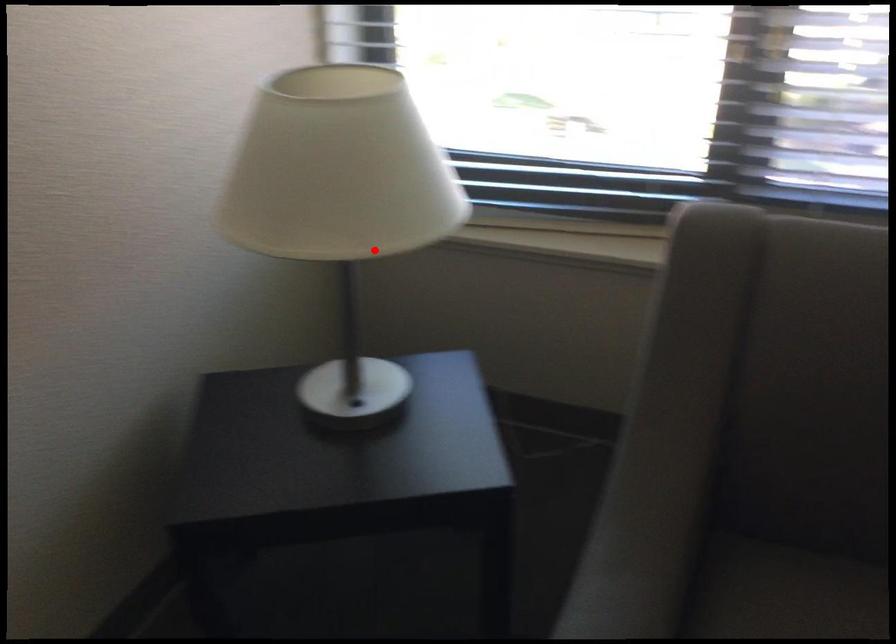
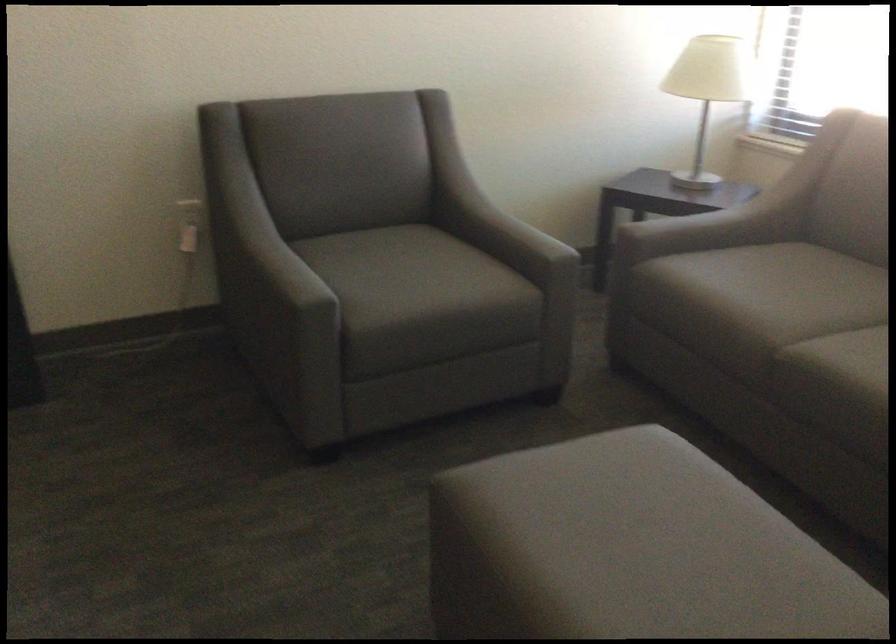
Question: I am providing you with two images of the same scene from different viewpoints. A red point is marked on the first image. Is the red point's position out of view in image 2?

Choices:
 (A) Yes
 (B) No

Answer: (B)